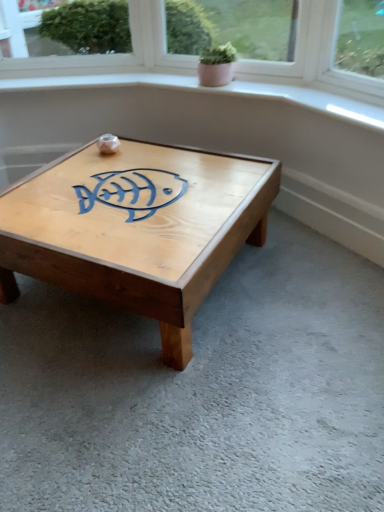
Where is `free space above natural wood coffee table at center (from a real-world perspective)`? This screenshot has width=384, height=512. free space above natural wood coffee table at center (from a real-world perspective) is located at coordinates (160, 174).